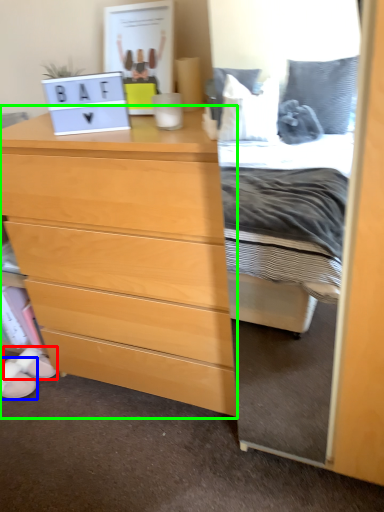
Question: Estimate the real-world distances between objects in this image. Which object is farther from shoe (highlighted by a red box), shoe (highlighted by a blue box) or chest of drawers (highlighted by a green box)?

Choices:
 (A) shoe
 (B) chest of drawers

Answer: (B)